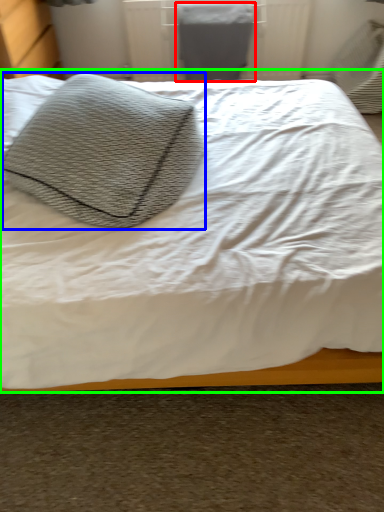
Question: Which is farther away from gray (highlighted by a red box)? throw pillow (highlighted by a blue box) or bed (highlighted by a green box)?

Choices:
 (A) throw pillow
 (B) bed

Answer: (A)